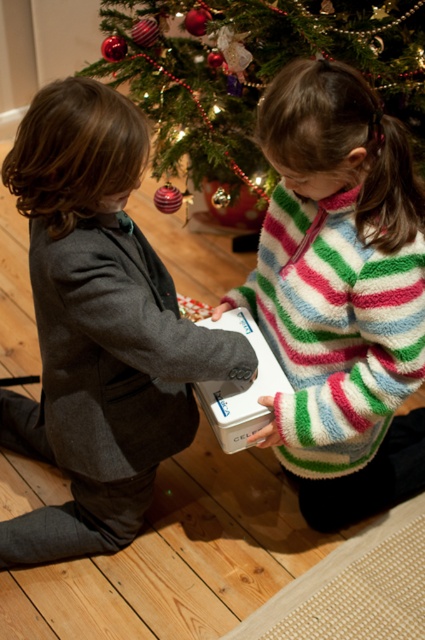
Question: Is dark gray suit at left to the right of green textured christmas tree at upper center from the viewer's perspective?

Choices:
 (A) no
 (B) yes

Answer: (A)

Question: Estimate the real-world distances between objects in this image. Which object is closer to the green textured christmas tree at upper center?

Choices:
 (A) white matte box at center
 (B) white fluffy sweater at center
 (C) dark gray suit at left

Answer: (B)

Question: Which of the following is the farthest from the observer?

Choices:
 (A) (130, 472)
 (B) (362, 298)
 (C) (274, 365)

Answer: (A)

Question: Is green textured christmas tree at upper center positioned before white matte box at center?

Choices:
 (A) no
 (B) yes

Answer: (A)

Question: In this image, where is dark gray suit at left located relative to green textured christmas tree at upper center?

Choices:
 (A) above
 (B) below

Answer: (B)

Question: Which point is closer to the camera?

Choices:
 (A) (2, 428)
 (B) (214, 17)
 (C) (226, 445)
 (D) (365, 212)

Answer: (D)